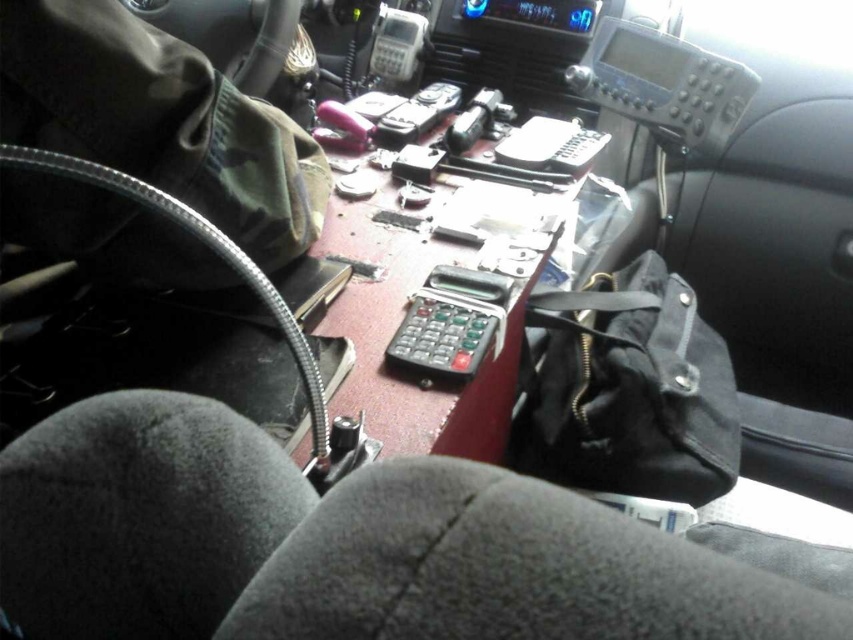
Is point (592, 305) positioned after point (407, 38)?

No, it is not.

Does black canvas bag at center lie behind gray plastic radio at center?

No, black canvas bag at center is closer to the viewer.

This screenshot has height=640, width=853. In order to click on black canvas bag at center in this screenshot , I will do `click(633, 388)`.

Is black plastic calculator at center below gray plastic radio at center?

Yes.

In the scene shown: Can you confirm if black plastic calculator at center is positioned to the right of gray plastic radio at center?

Correct, you'll find black plastic calculator at center to the right of gray plastic radio at center.

Describe the element at coordinates (451, 323) in the screenshot. I see `black plastic calculator at center` at that location.

The width and height of the screenshot is (853, 640). Find the location of `black plastic calculator at center`. black plastic calculator at center is located at coordinates (451, 323).

Who is taller, black canvas bag at center or black plastic calculator at center?

black canvas bag at center is taller.

Is black canvas bag at center smaller than black plastic calculator at center?

No, black canvas bag at center is not smaller than black plastic calculator at center.

Is point (691, 419) in front of point (486, 339)?

No, it is behind (486, 339).

This screenshot has height=640, width=853. I want to click on black canvas bag at center, so click(x=633, y=388).